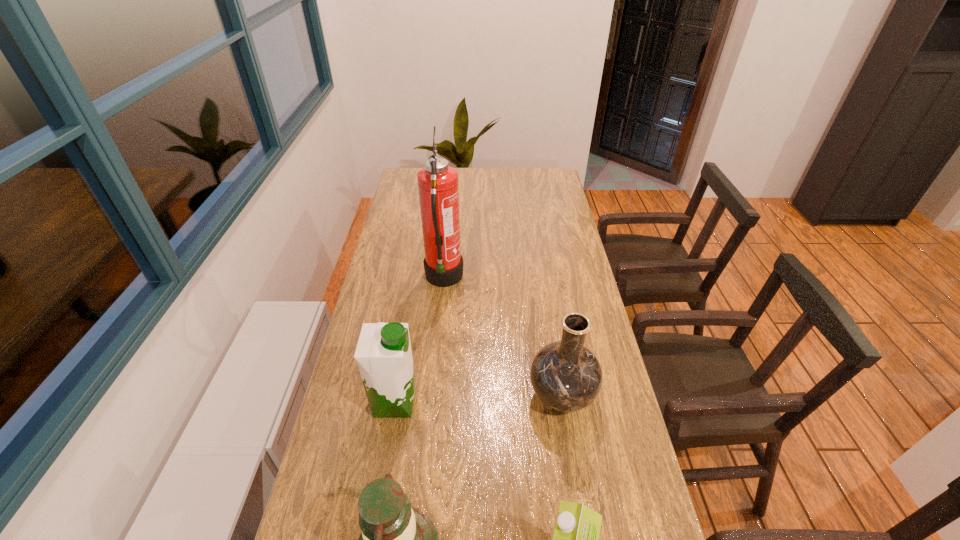
At what (x,y) coordinates should I click in order to perform the action: click on vacant space at the far edge. Please return your answer as a coordinate pair (x, y). Image resolution: width=960 pixels, height=540 pixels. Looking at the image, I should click on (506, 192).

You are a GUI agent. You are given a task and a screenshot of the screen. Output one action in this format:
    pyautogui.click(x=<x>, y=<y>)
    Task: Click on the vacant space at the left edge of the desktop
    The width and height of the screenshot is (960, 540).
    Given the screenshot: What is the action you would take?
    pyautogui.click(x=418, y=234)

Locate an element on the screen. vacant space at the right edge of the desktop is located at coordinates (542, 199).

I want to click on free space at the far right corner of the desktop, so click(x=544, y=181).

This screenshot has width=960, height=540. Identify the location of vacant space that is in between the farthest object and the vase. (503, 338).

Find the location of a particular element. The height and width of the screenshot is (540, 960). free space between the left soya milk and the tallest object is located at coordinates (420, 341).

Where is `unoccupied position between the vase and the farthest object`? unoccupied position between the vase and the farthest object is located at coordinates (503, 338).

The width and height of the screenshot is (960, 540). In order to click on free point between the taller soya milk and the vase in this screenshot , I will do `click(478, 399)`.

Image resolution: width=960 pixels, height=540 pixels. I want to click on object that ranks as the closest to the nearer soya milk, so click(396, 539).

Point out which object is positioned as the second nearest to the farthest object. Please provide its 2D coordinates. Your answer should be formatted as a tuple, i.e. [(x, y)], where the tuple contains the x and y coordinates of a point satisfying the conditions above.

[(566, 376)]